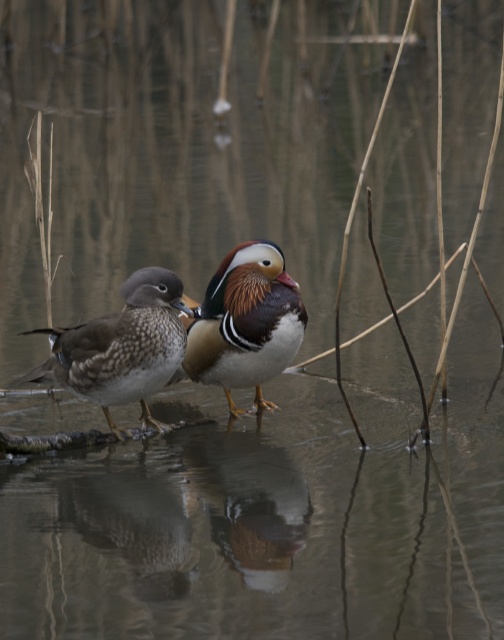
Question: Can you confirm if speckled feather duck at left is positioned to the left of shiny brown duck at center?

Choices:
 (A) no
 (B) yes

Answer: (B)

Question: Does speckled feather duck at left have a smaller size compared to shiny brown duck at center?

Choices:
 (A) no
 (B) yes

Answer: (A)

Question: Is speckled feather duck at left further to the viewer compared to shiny brown duck at center?

Choices:
 (A) yes
 (B) no

Answer: (B)

Question: Which point appears closest to the camera in this image?

Choices:
 (A) (287, 298)
 (B) (106, 321)

Answer: (B)